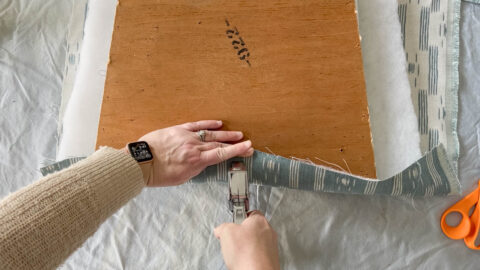
I want to click on metal stapler, so click(231, 186).